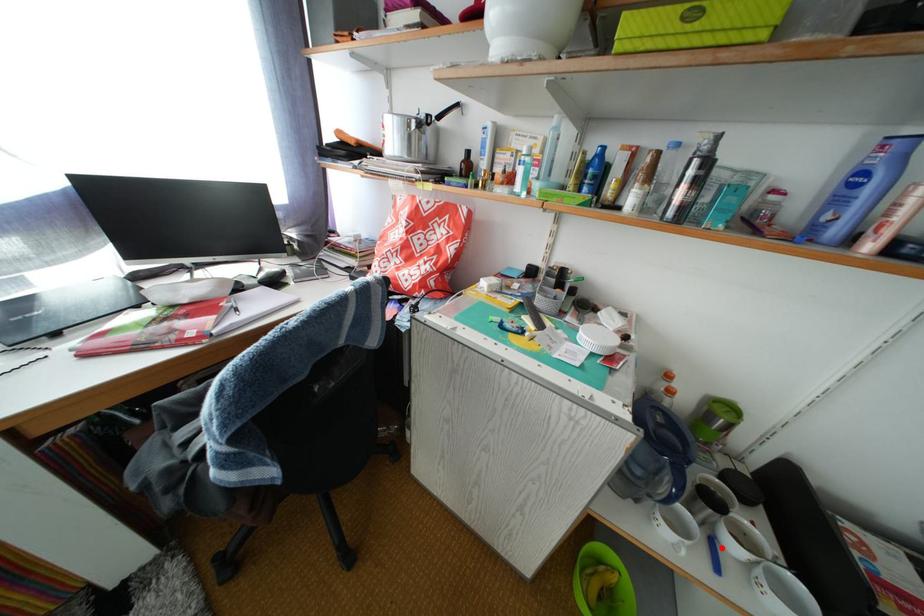
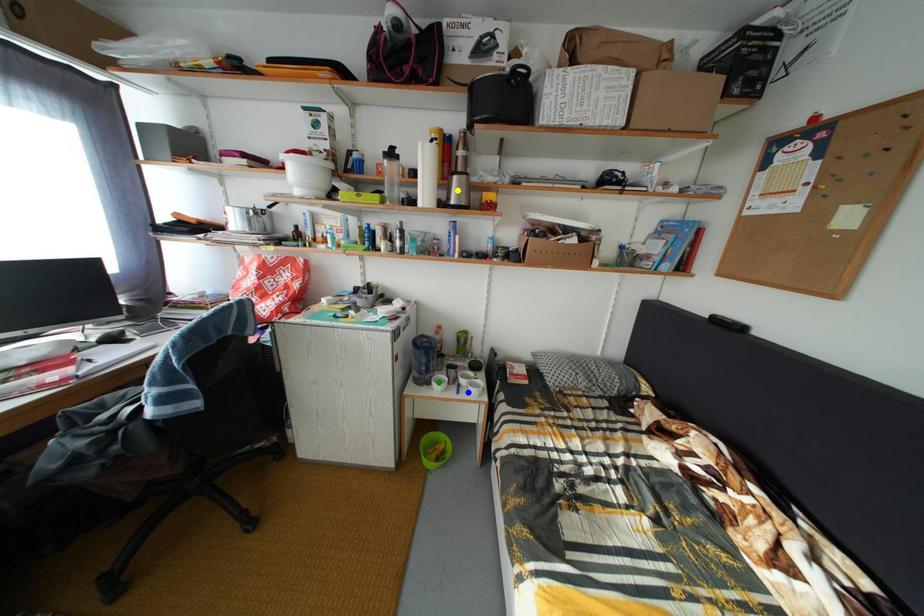
Question: I am providing you with two images of the same scene from different viewpoints. A red point is marked on the first image. You are given multiple points on the second image. In image 2, which mark is for the same physical point as the one in image 1?

Choices:
 (A) blue point
 (B) yellow point
 (C) green point

Answer: (A)